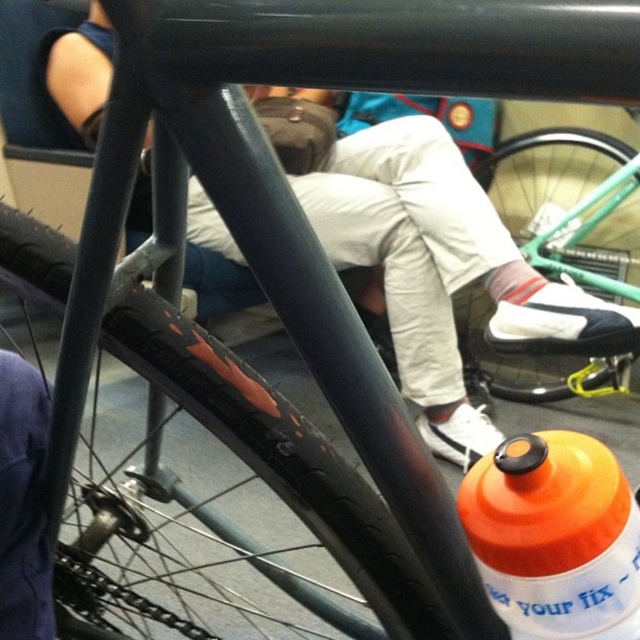
Which is below, white cotton pants at center or green rubber tire at lower center?

white cotton pants at center is lower down.

What do you see at coordinates (438, 266) in the screenshot? The height and width of the screenshot is (640, 640). I see `white cotton pants at center` at bounding box center [438, 266].

Does point (298, 196) come closer to viewer compared to point (529, 216)?

Yes, point (298, 196) is closer to viewer.

Identify the location of white cotton pants at center. Image resolution: width=640 pixels, height=640 pixels. (x=438, y=266).

Does white cotton pants at center come behind dark blue fabric at lower left?

Yes, white cotton pants at center is behind dark blue fabric at lower left.

Measure the distance between white cotton pants at center and camera.

The distance of white cotton pants at center from camera is 1.23 meters.

Identify the location of white cotton pants at center. (438, 266).

Does orange matte bottle at center have a greater width compared to green rubber tire at lower center?

No.

Between orange matte bottle at center and green rubber tire at lower center, which one has more height?

With more height is green rubber tire at lower center.

Does point (598, 620) lie behind point (592, 170)?

No, (598, 620) is closer to viewer.

Identify the location of orange matte bottle at center. This screenshot has height=640, width=640. (554, 532).